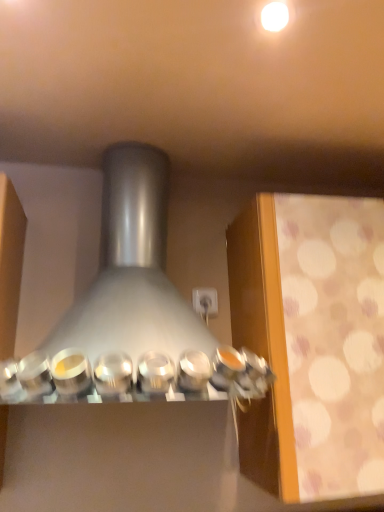
Locate an element on the screen. The width and height of the screenshot is (384, 512). vacant space behind white glossy light bulb at upper center is located at coordinates (259, 81).